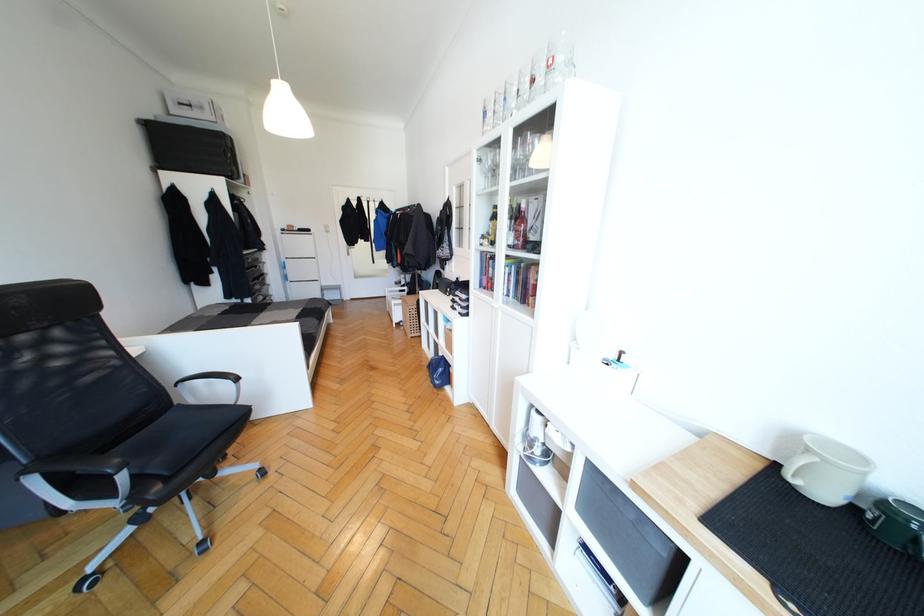
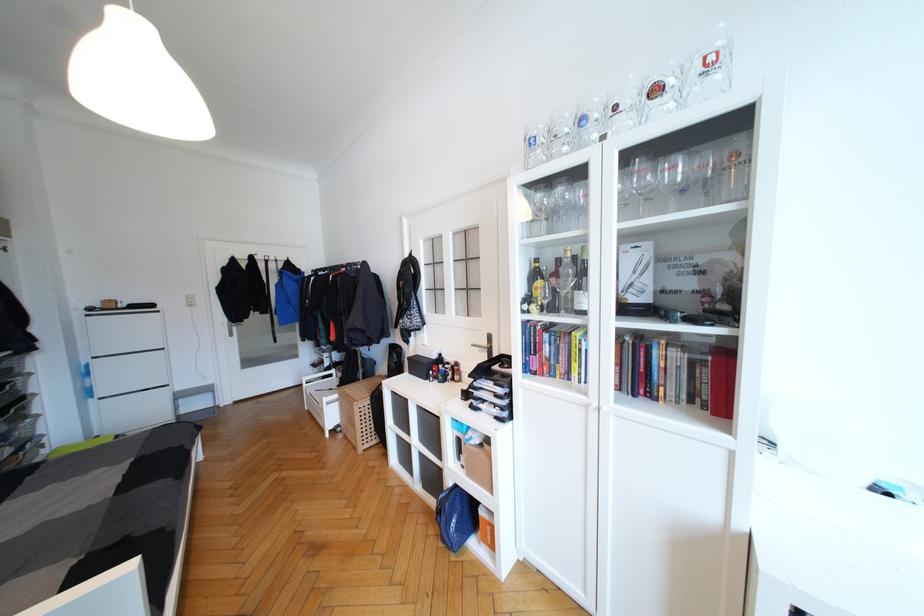
Locate, in the second image, the point that corresponds to point (445, 363) in the first image.

(460, 501)